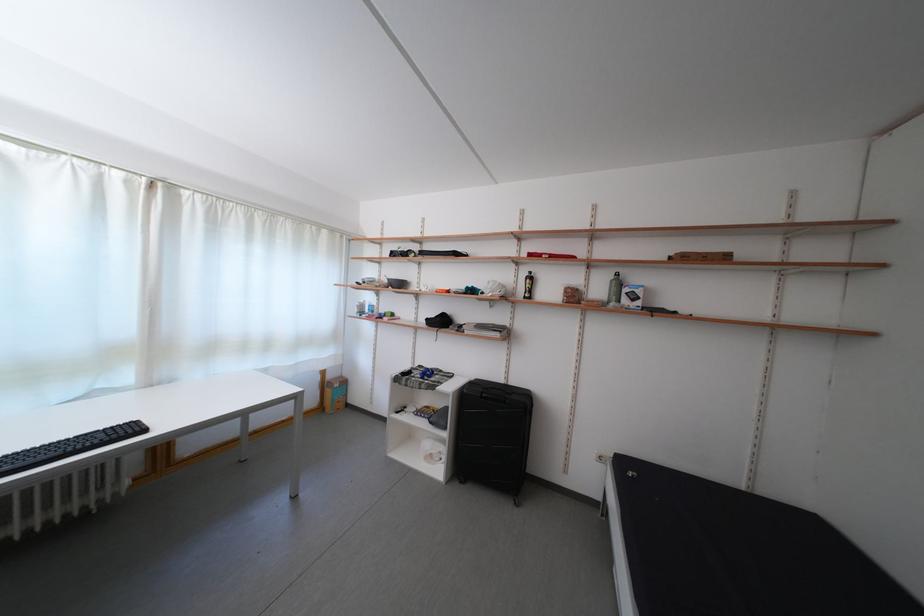
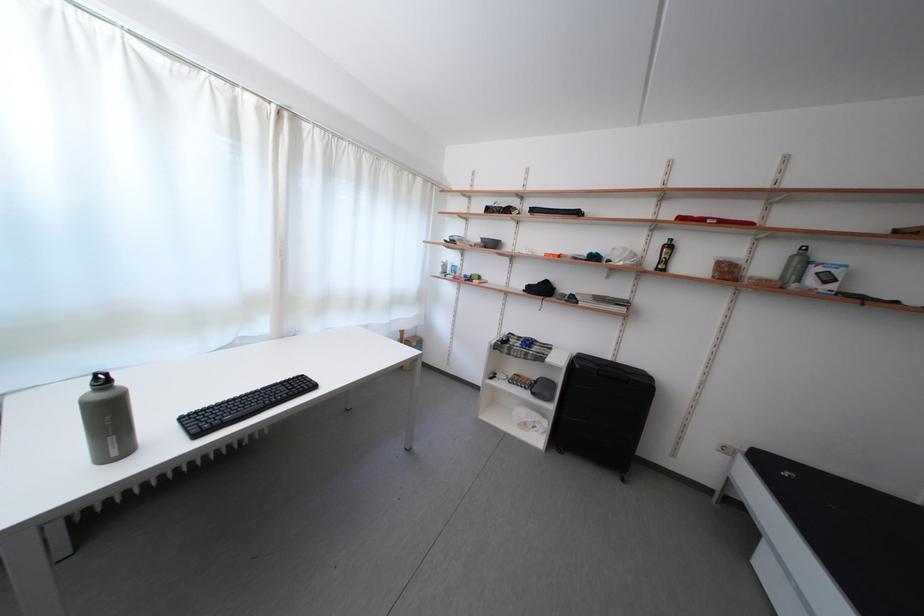
The point at (532,278) is marked in the first image. Where is the corresponding point in the second image?

(669, 246)